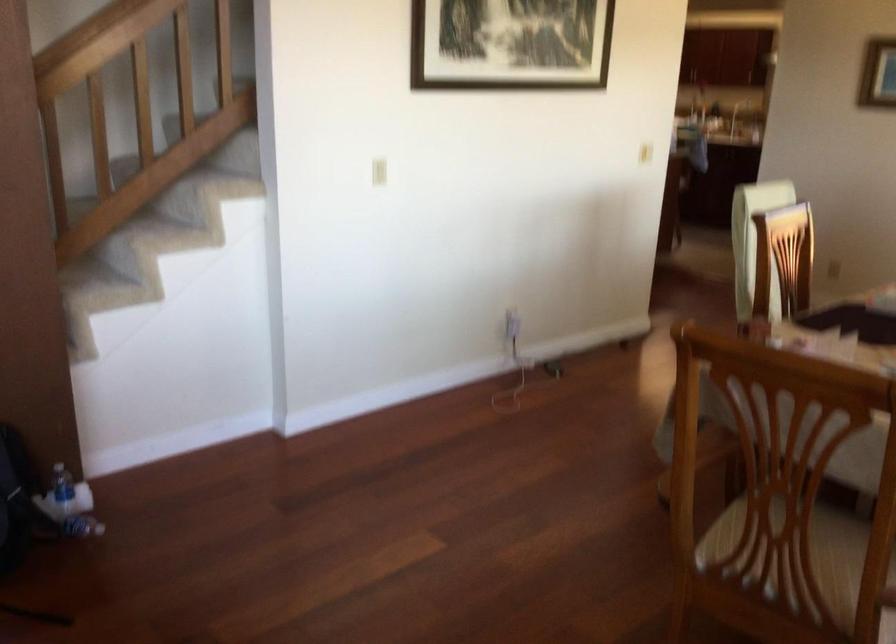
Find where to grasp the wooden handrail. Please return your answer as a coordinate pair (x, y).

(104, 40)